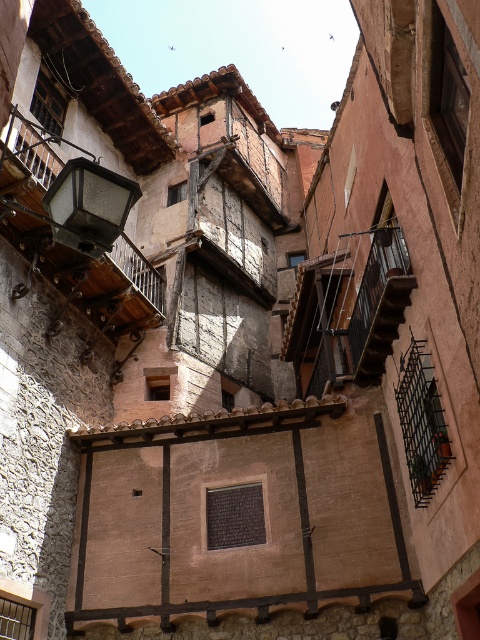
Question: Is matte black lantern at upper left positioned before wooden stairs at center?

Choices:
 (A) yes
 (B) no

Answer: (A)

Question: Is wooden balcony at left below matte black lantern at upper left?

Choices:
 (A) yes
 (B) no

Answer: (B)

Question: Which of the following is the closest to the observer?

Choices:
 (A) (13, 209)
 (B) (118, 221)

Answer: (B)

Question: Can you confirm if wooden balcony at left is thinner than matte black lantern at upper left?

Choices:
 (A) no
 (B) yes

Answer: (A)

Question: Which object is the closest to the wooden balcony at left?

Choices:
 (A) matte black lantern at upper left
 (B) wooden stairs at center

Answer: (B)

Question: Which object appears farthest from the camera in this image?

Choices:
 (A) matte black lantern at upper left
 (B) wooden balcony at left

Answer: (A)